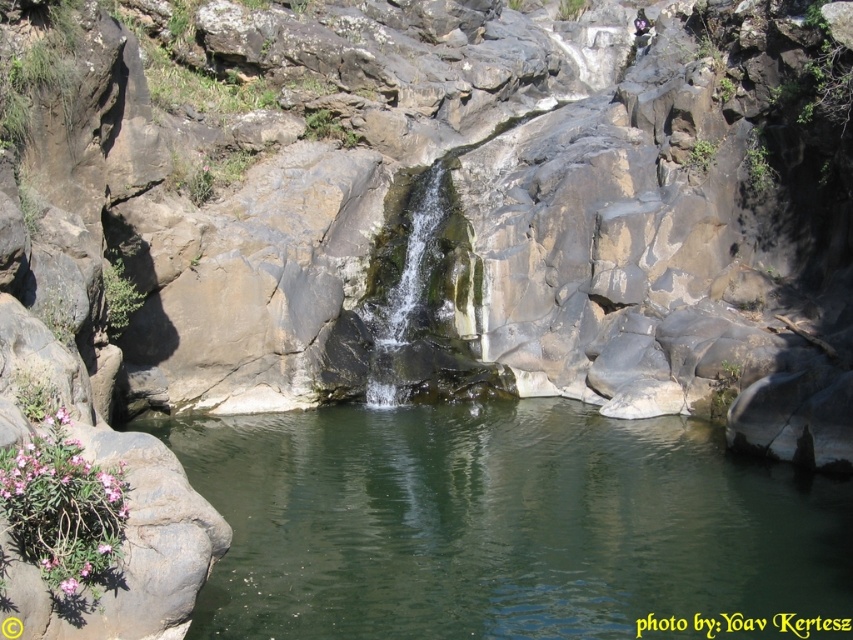
Is point (666, 496) more distant than point (425, 358)?

No, (666, 496) is in front of (425, 358).

This screenshot has width=853, height=640. What do you see at coordinates (503, 524) in the screenshot?
I see `green smooth water at center` at bounding box center [503, 524].

Locate an element on the screen. The image size is (853, 640). green smooth water at center is located at coordinates (503, 524).